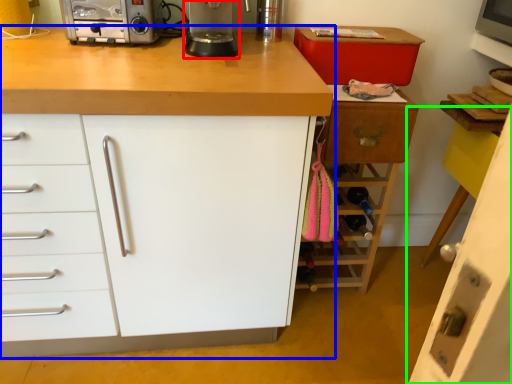
Question: Estimate the real-world distances between objects in this image. Which object is farther from kitchen appliance (highlighted by a red box), cabinetry (highlighted by a blue box) or cabinetry (highlighted by a green box)?

Choices:
 (A) cabinetry
 (B) cabinetry

Answer: (B)